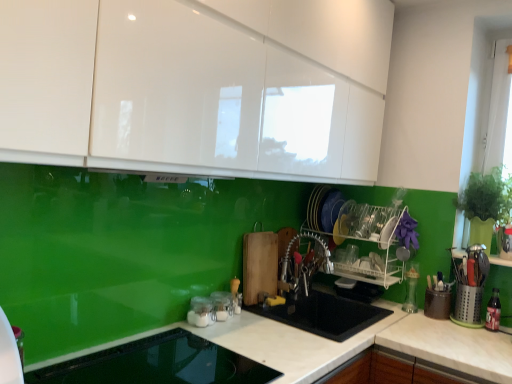
Question: From a real-world perspective, is clear plastic bottle at right, which is the first appliance from right to left, located beneath white plastic dish rack at center, which is the 4th appliance from left to right?

Choices:
 (A) no
 (B) yes

Answer: (B)

Question: From the image's perspective, does clear plastic bottle at right, arranged as the sixth appliance when viewed from the left, appear higher than white plastic dish rack at center, the third appliance when ordered from right to left?

Choices:
 (A) no
 (B) yes

Answer: (A)

Question: Is clear plastic bottle at right, positioned as the fifth appliance in front-to-back order, behind white plastic dish rack at center, which is the 4th appliance from left to right?

Choices:
 (A) yes
 (B) no

Answer: (B)

Question: Is clear plastic bottle at right, positioned as the fifth appliance in front-to-back order, taller than white plastic dish rack at center, the first appliance in the back-to-front sequence?

Choices:
 (A) no
 (B) yes

Answer: (A)

Question: Does clear plastic bottle at right, which is the first appliance from right to left, have a larger size compared to white plastic dish rack at center, placed as the sixth appliance when sorted from front to back?

Choices:
 (A) no
 (B) yes

Answer: (A)

Question: Is clear plastic bottle at right, arranged as the sixth appliance when viewed from the left, smaller than white plastic dish rack at center, which is the 4th appliance from left to right?

Choices:
 (A) no
 (B) yes

Answer: (B)

Question: From a real-world perspective, is clear glass jars at center, the 4th appliance from the back, located beneath clear plastic bottle at right, the 2th appliance viewed from the back?

Choices:
 (A) yes
 (B) no

Answer: (A)

Question: Is clear glass jars at center, the 4th appliance from the back, positioned beyond the bounds of clear plastic bottle at right, arranged as the sixth appliance when viewed from the left?

Choices:
 (A) yes
 (B) no

Answer: (A)

Question: Considering the relative sizes of clear glass jars at center, marked as the 3th appliance in a front-to-back arrangement, and clear plastic bottle at right, the 2th appliance viewed from the back, in the image provided, is clear glass jars at center, marked as the 3th appliance in a front-to-back arrangement, shorter than clear plastic bottle at right, the 2th appliance viewed from the back,?

Choices:
 (A) yes
 (B) no

Answer: (A)

Question: Considering the relative sizes of clear glass jars at center, the fourth appliance from the right, and clear plastic bottle at right, arranged as the sixth appliance when viewed from the left, in the image provided, is clear glass jars at center, the fourth appliance from the right, taller than clear plastic bottle at right, arranged as the sixth appliance when viewed from the left,?

Choices:
 (A) yes
 (B) no

Answer: (B)

Question: Is clear glass jars at center, the 4th appliance from the back, beside clear plastic bottle at right, which is the first appliance from right to left?

Choices:
 (A) no
 (B) yes

Answer: (A)

Question: Is clear glass jars at center, the fourth appliance from the right, far away from clear plastic bottle at right, positioned as the fifth appliance in front-to-back order?

Choices:
 (A) no
 (B) yes

Answer: (B)

Question: Is clear glass jars at lower center, the second appliance in the left-to-right sequence, taller than white plastic dish rack at center, placed as the sixth appliance when sorted from front to back?

Choices:
 (A) yes
 (B) no

Answer: (B)